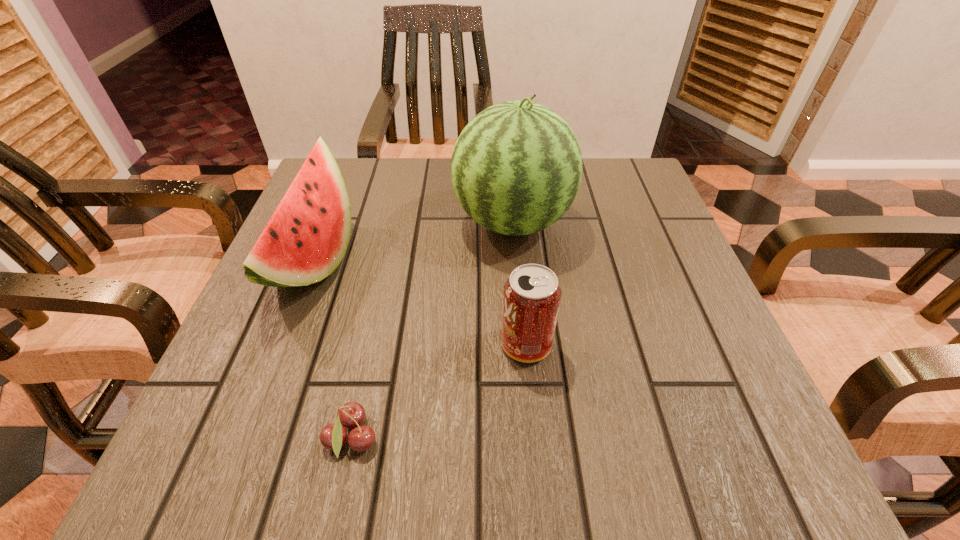
Identify which object is the third nearest to the second shortest object. Please provide its 2D coordinates. Your answer should be formatted as a tuple, i.e. [(x, y)], where the tuple contains the x and y coordinates of a point satisfying the conditions above.

[(306, 238)]

Where is `vacant space that satisfies the following two spatial constraints: 1. on the front side of the taller watermelon; 2. on the leaves of the shortest object`? vacant space that satisfies the following two spatial constraints: 1. on the front side of the taller watermelon; 2. on the leaves of the shortest object is located at coordinates (531, 440).

You are a GUI agent. You are given a task and a screenshot of the screen. Output one action in this format:
    pyautogui.click(x=<x>, y=<y>)
    Task: Click on the vacant area in the image that satisfies the following two spatial constraints: 1. on the outer rind of the leftmost object; 2. on the back side of the soda can
    The height and width of the screenshot is (540, 960).
    Given the screenshot: What is the action you would take?
    pyautogui.click(x=281, y=345)

Find the location of a particular element. free spot that satisfies the following two spatial constraints: 1. on the front side of the right watermelon; 2. on the outer rind of the shorter watermelon is located at coordinates (516, 261).

Where is `vacant point that satisfies the following two spatial constraints: 1. on the back side of the third tallest object; 2. on the outer rind of the left watermelon`? The height and width of the screenshot is (540, 960). vacant point that satisfies the following two spatial constraints: 1. on the back side of the third tallest object; 2. on the outer rind of the left watermelon is located at coordinates (518, 261).

This screenshot has width=960, height=540. I want to click on free spot that satisfies the following two spatial constraints: 1. on the outer rind of the third tallest object; 2. on the right side of the shorter watermelon, so click(281, 345).